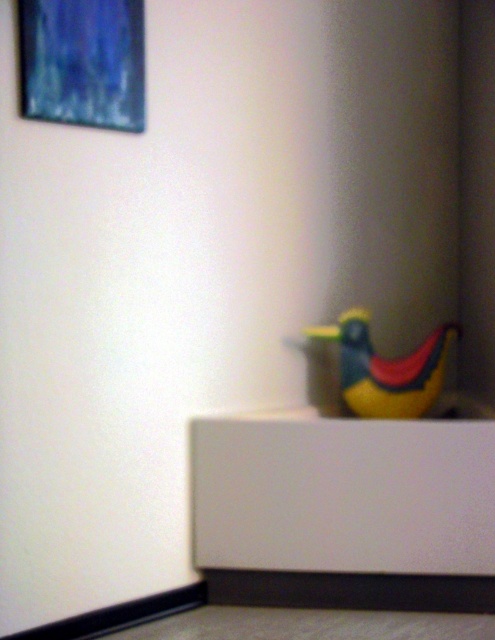
Can you confirm if blue textured canvas at upper left is smaller than yellow rubber duck at lower right?

Yes.

Who is higher up, blue textured canvas at upper left or yellow rubber duck at lower right?

blue textured canvas at upper left

Which is behind, point (36, 52) or point (338, 336)?

The point (338, 336) is more distant.

At what (x,y) coordinates should I click in order to perform the action: click on blue textured canvas at upper left. Please return your answer as a coordinate pair (x, y). Looking at the image, I should click on (83, 61).